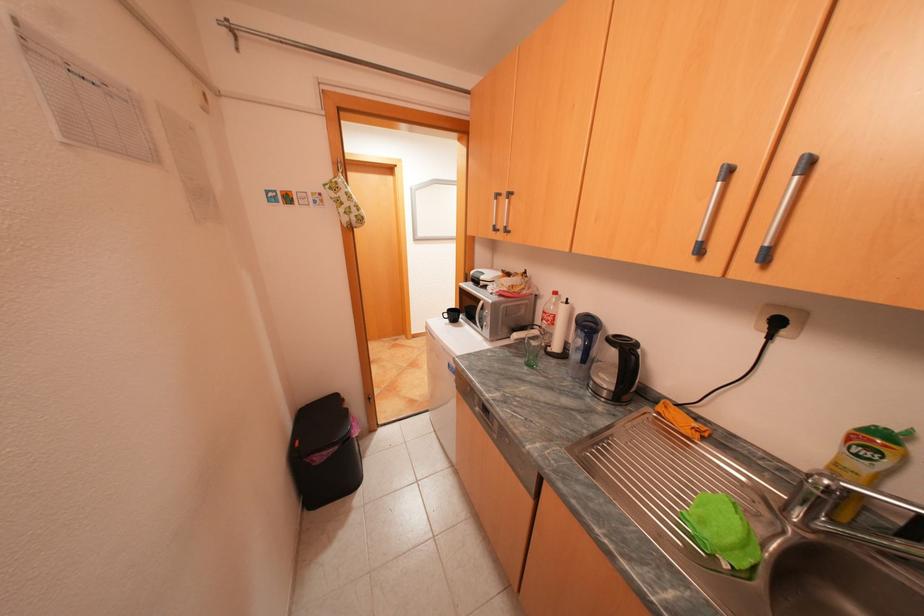
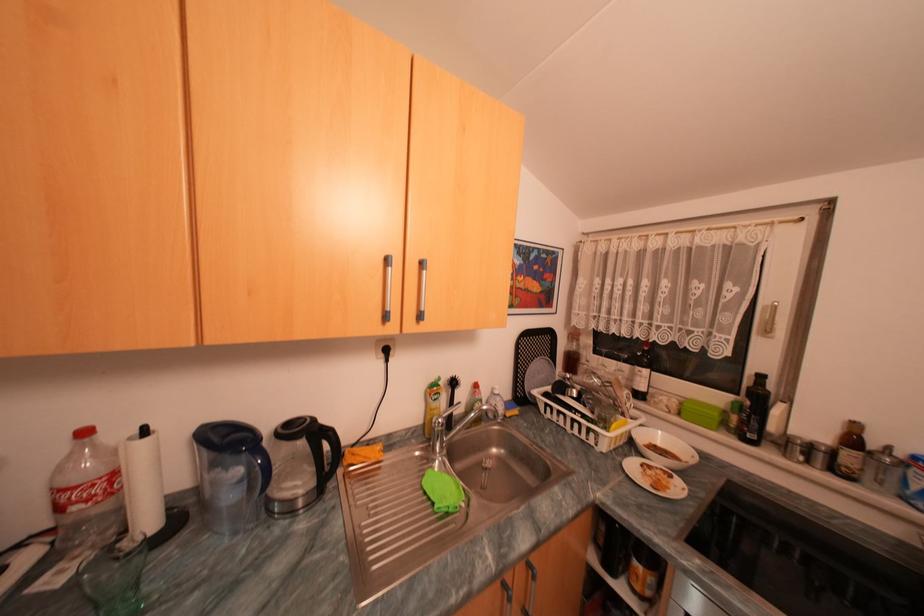
Where in the second image is the point corresponding to (577,302) from the first image?

(155, 432)